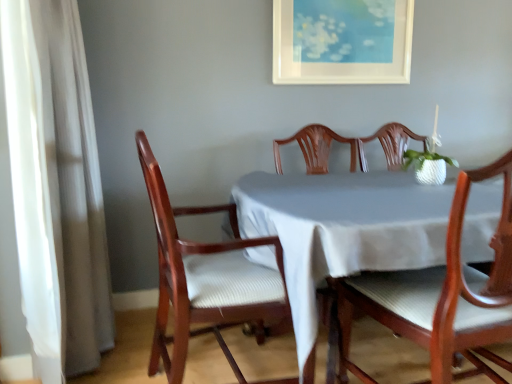
Question: From the image's perspective, is white sheer curtain at left on top of white matte picture frame at upper center?

Choices:
 (A) yes
 (B) no

Answer: (B)

Question: Considering the relative sizes of white sheer curtain at left and white matte picture frame at upper center in the image provided, is white sheer curtain at left wider than white matte picture frame at upper center?

Choices:
 (A) yes
 (B) no

Answer: (A)

Question: Is white sheer curtain at left aimed at white matte picture frame at upper center?

Choices:
 (A) yes
 (B) no

Answer: (B)

Question: From a real-world perspective, is white sheer curtain at left located higher than white matte picture frame at upper center?

Choices:
 (A) yes
 (B) no

Answer: (B)

Question: From a real-world perspective, is white sheer curtain at left below white matte picture frame at upper center?

Choices:
 (A) no
 (B) yes

Answer: (B)

Question: Which is correct: white sheer curtain at left is inside wooden chair at left, the 1th chair viewed from the left, or outside of it?

Choices:
 (A) outside
 (B) inside

Answer: (A)

Question: Visually, is white sheer curtain at left positioned to the left or to the right of wooden chair at left, placed as the 2th chair when sorted from right to left?

Choices:
 (A) left
 (B) right

Answer: (A)

Question: Considering the positions of white sheer curtain at left and wooden chair at left, the 1th chair viewed from the left, in the image, is white sheer curtain at left wider or thinner than wooden chair at left, the 1th chair viewed from the left,?

Choices:
 (A) wide
 (B) thin

Answer: (B)

Question: From the image's perspective, is white sheer curtain at left positioned above or below wooden chair at left, placed as the 2th chair when sorted from right to left?

Choices:
 (A) above
 (B) below

Answer: (A)

Question: Is white matte picture frame at upper center spatially inside wooden chair at center, the 2th chair when ordered from left to right, or outside of it?

Choices:
 (A) outside
 (B) inside

Answer: (A)

Question: Is white matte picture frame at upper center wider or thinner than wooden chair at center, the 2th chair when ordered from left to right?

Choices:
 (A) thin
 (B) wide

Answer: (A)

Question: Is white matte picture frame at upper center taller or shorter than wooden chair at center, the 2th chair when ordered from left to right?

Choices:
 (A) tall
 (B) short

Answer: (B)

Question: From the image's perspective, relative to wooden chair at center, marked as the 1th chair in a right-to-left arrangement, is white matte picture frame at upper center above or below?

Choices:
 (A) below
 (B) above

Answer: (B)

Question: Is wooden chair at left, placed as the 2th chair when sorted from right to left, inside the boundaries of wooden chair at center, the 2th chair when ordered from left to right, or outside?

Choices:
 (A) outside
 (B) inside

Answer: (A)

Question: In the image, is wooden chair at left, placed as the 2th chair when sorted from right to left, positioned in front of or behind wooden chair at center, the 2th chair when ordered from left to right?

Choices:
 (A) front
 (B) behind

Answer: (B)